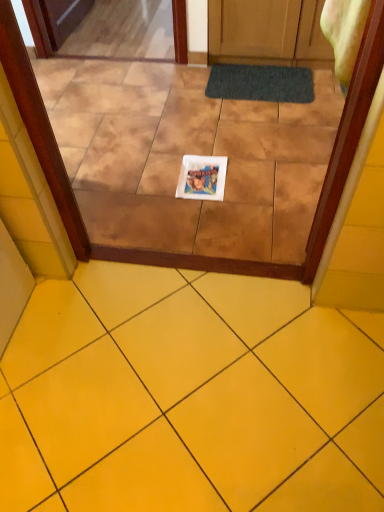
Question: Is transparent glass door at center at the back of white paper at center?

Choices:
 (A) yes
 (B) no

Answer: (A)

Question: Does white paper at center have a lesser width compared to transparent glass door at center?

Choices:
 (A) yes
 (B) no

Answer: (A)

Question: Is white paper at center not close to transparent glass door at center?

Choices:
 (A) yes
 (B) no

Answer: (B)

Question: Does white paper at center come behind transparent glass door at center?

Choices:
 (A) yes
 (B) no

Answer: (A)

Question: Can you confirm if white paper at center is bigger than transparent glass door at center?

Choices:
 (A) no
 (B) yes

Answer: (A)

Question: From the image's perspective, is transparent glass door at center above or below yellow ceramic tile at lower center?

Choices:
 (A) above
 (B) below

Answer: (A)

Question: From a real-world perspective, is transparent glass door at center positioned above or below yellow ceramic tile at lower center?

Choices:
 (A) above
 (B) below

Answer: (B)

Question: Considering their positions, is transparent glass door at center located in front of or behind yellow ceramic tile at lower center?

Choices:
 (A) front
 (B) behind

Answer: (B)

Question: Looking at the image, does transparent glass door at center seem bigger or smaller compared to yellow ceramic tile at lower center?

Choices:
 (A) small
 (B) big

Answer: (B)

Question: Considering the positions of white paper at center and transparent glass door at center in the image, is white paper at center wider or thinner than transparent glass door at center?

Choices:
 (A) thin
 (B) wide

Answer: (A)

Question: Would you say white paper at center is to the left or to the right of transparent glass door at center in the picture?

Choices:
 (A) left
 (B) right

Answer: (B)

Question: Considering the positions of white paper at center and transparent glass door at center in the image, is white paper at center taller or shorter than transparent glass door at center?

Choices:
 (A) tall
 (B) short

Answer: (B)

Question: Is white paper at center situated inside transparent glass door at center or outside?

Choices:
 (A) inside
 (B) outside

Answer: (A)

Question: Is transparent glass door at center bigger or smaller than dark gray textured bath mat at center?

Choices:
 (A) small
 (B) big

Answer: (B)

Question: Is transparent glass door at center spatially inside dark gray textured bath mat at center, or outside of it?

Choices:
 (A) inside
 (B) outside

Answer: (B)